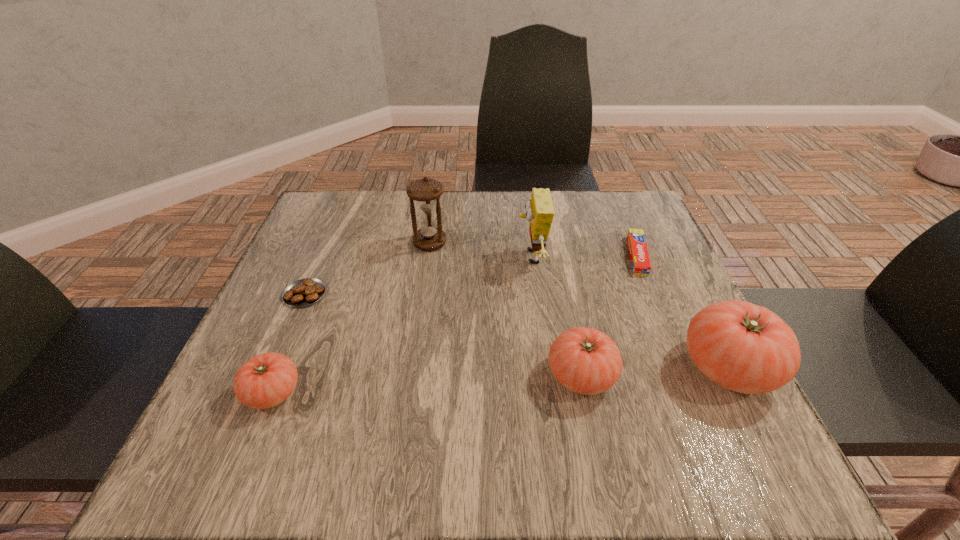
In the image, there is a desktop. Where is `vacant space at the near edge`? vacant space at the near edge is located at coordinates (585, 423).

The width and height of the screenshot is (960, 540). Find the location of `free space at the left edge of the desktop`. free space at the left edge of the desktop is located at coordinates (305, 247).

In the image, there is a desktop. Where is `vacant space at the right edge`? vacant space at the right edge is located at coordinates pyautogui.click(x=637, y=309).

In the image, there is a desktop. Where is `vacant space at the far left corner`? vacant space at the far left corner is located at coordinates (348, 223).

Locate an element on the screen. Image resolution: width=960 pixels, height=540 pixels. free spot at the near left corner of the desktop is located at coordinates (301, 382).

Locate an element on the screen. This screenshot has width=960, height=540. free space at the far right corner of the desktop is located at coordinates (602, 205).

The width and height of the screenshot is (960, 540). Find the location of `vacant region at the near right corner`. vacant region at the near right corner is located at coordinates coord(683,411).

The image size is (960, 540). I want to click on vacant region between the fifth tallest object and the fifth shortest object, so click(500, 380).

The width and height of the screenshot is (960, 540). I want to click on free area in between the toothpaste and the rightmost tomato, so click(683, 312).

At what (x,y) coordinates should I click in order to perform the action: click on free spot between the fifth object from right to left and the shortest tomato. Please return your answer as a coordinate pair (x, y). The width and height of the screenshot is (960, 540). Looking at the image, I should click on (351, 318).